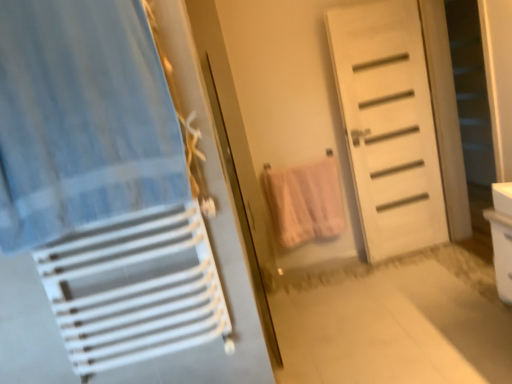
Question: Can you confirm if white matte door at center is smaller than pink cotton towel at center?

Choices:
 (A) no
 (B) yes

Answer: (A)

Question: Can you confirm if white matte door at center is positioned to the right of pink cotton towel at center?

Choices:
 (A) no
 (B) yes

Answer: (B)

Question: Is white matte door at center taller than pink cotton towel at center?

Choices:
 (A) no
 (B) yes

Answer: (B)

Question: Can you confirm if white matte door at center is bigger than pink cotton towel at center?

Choices:
 (A) yes
 (B) no

Answer: (A)

Question: Is white matte door at center beside pink cotton towel at center?

Choices:
 (A) no
 (B) yes

Answer: (A)

Question: Is white matte screen door at right wider or thinner than pink cotton towel at center?

Choices:
 (A) thin
 (B) wide

Answer: (A)

Question: From a real-world perspective, relative to pink cotton towel at center, is white matte screen door at right vertically above or below?

Choices:
 (A) below
 (B) above

Answer: (B)

Question: Is white matte screen door at right to the left or to the right of pink cotton towel at center in the image?

Choices:
 (A) right
 (B) left

Answer: (A)

Question: Is white matte screen door at right taller or shorter than pink cotton towel at center?

Choices:
 (A) short
 (B) tall

Answer: (B)

Question: Considering the positions of pink cotton towel at center and white matte screen door at right in the image, is pink cotton towel at center taller or shorter than white matte screen door at right?

Choices:
 (A) tall
 (B) short

Answer: (B)

Question: In the image, is pink cotton towel at center positioned in front of or behind white matte screen door at right?

Choices:
 (A) front
 (B) behind

Answer: (A)

Question: Looking at their shapes, would you say pink cotton towel at center is wider or thinner than white matte screen door at right?

Choices:
 (A) wide
 (B) thin

Answer: (A)

Question: From a real-world perspective, is pink cotton towel at center positioned above or below white matte screen door at right?

Choices:
 (A) below
 (B) above

Answer: (A)

Question: From a real-world perspective, is blue striped fabric at left above or below white plastic drawer at right?

Choices:
 (A) above
 (B) below

Answer: (A)

Question: Based on their positions, is blue striped fabric at left located to the left or right of white plastic drawer at right?

Choices:
 (A) left
 (B) right

Answer: (A)